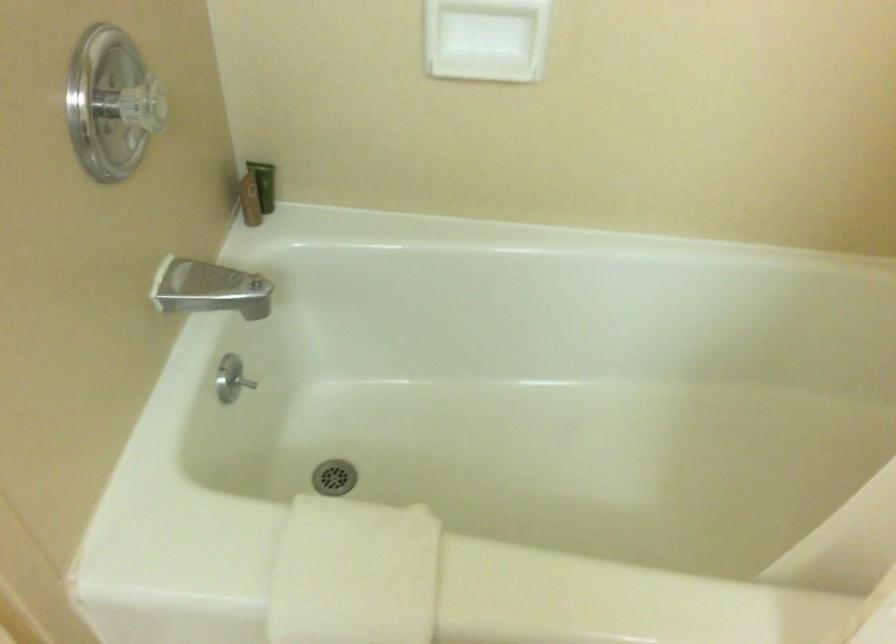
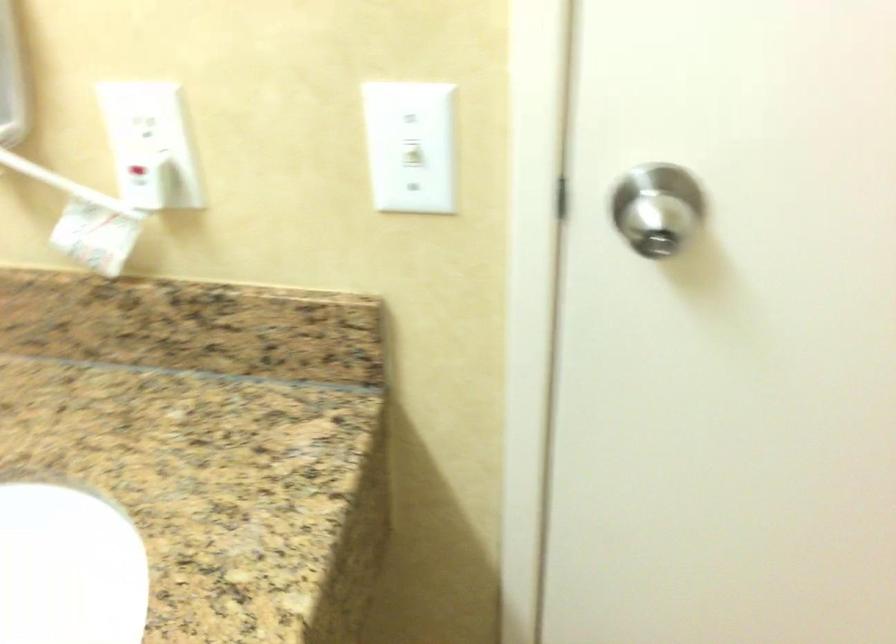
Based on the continuous images, in which direction is the camera rotating?

The camera's rotation is toward left-down.